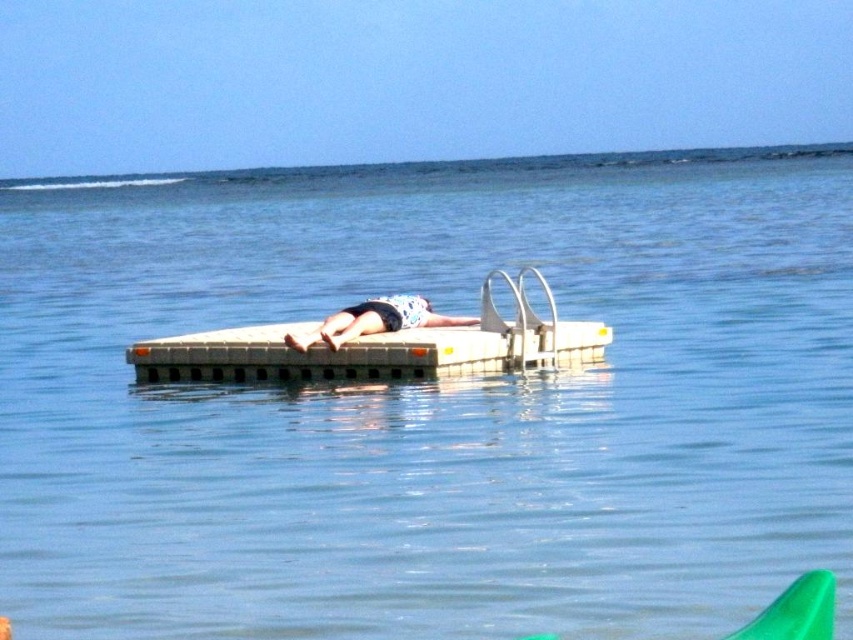
Which of these two, white plastic boat at center or floral fabric towel at center, stands shorter?

floral fabric towel at center

Can you confirm if white plastic boat at center is positioned to the right of floral fabric towel at center?

Indeed, white plastic boat at center is positioned on the right side of floral fabric towel at center.

Which is behind, point (593, 348) or point (315, 333)?

Point (593, 348)

Find the location of a particular element. The width and height of the screenshot is (853, 640). white plastic boat at center is located at coordinates (379, 346).